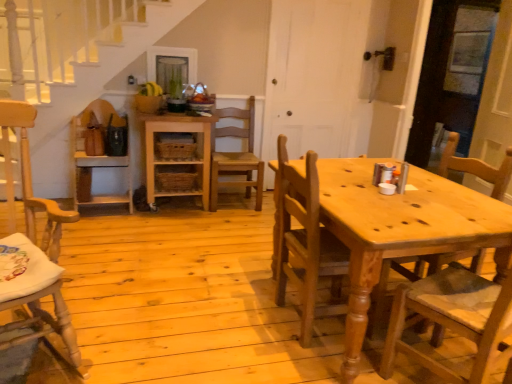
I want to click on free space in front of natural wood shelf at center, so click(153, 229).